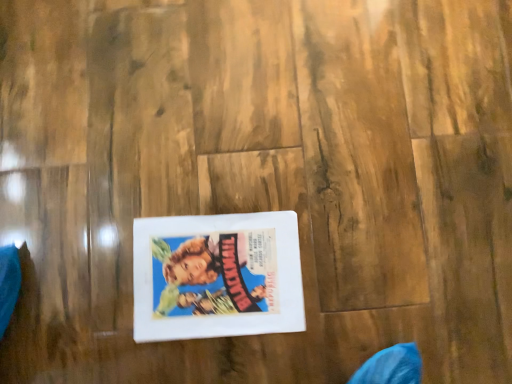
In order to click on white paper flyer at center in this screenshot , I will do `click(217, 276)`.

What do you see at coordinates (217, 276) in the screenshot? I see `white paper flyer at center` at bounding box center [217, 276].

I want to click on white paper flyer at center, so (217, 276).